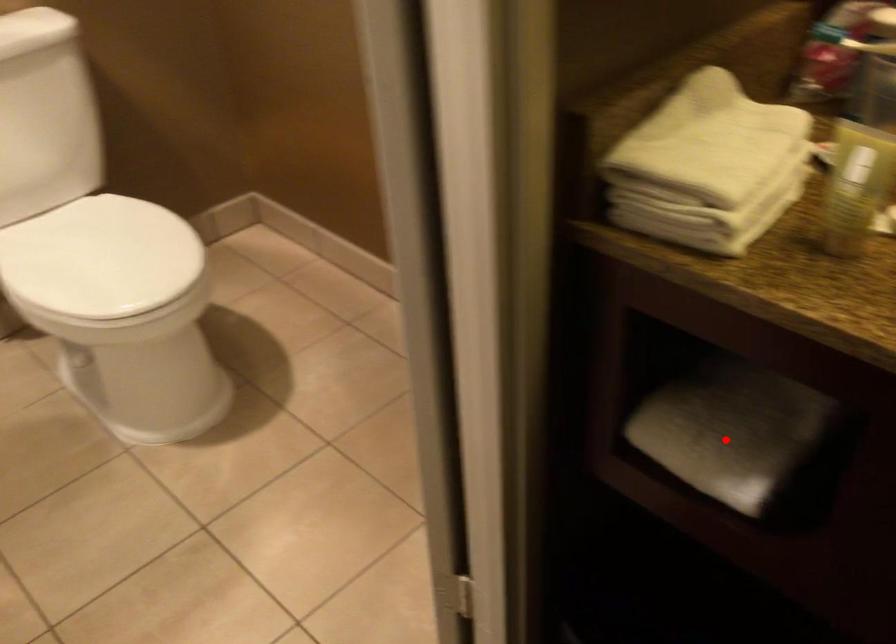
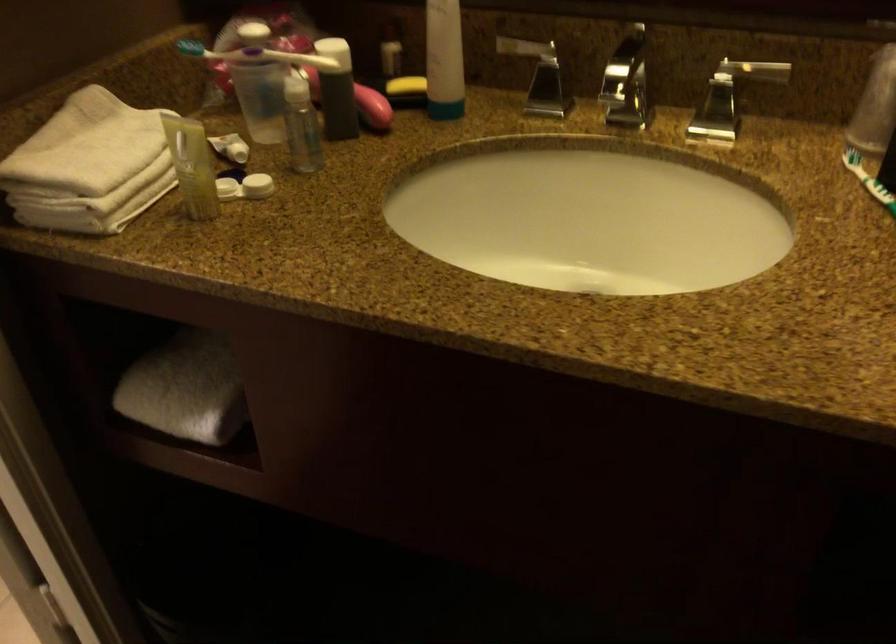
Where in the second image is the point corresponding to the highlighted location from the first image?

(185, 389)